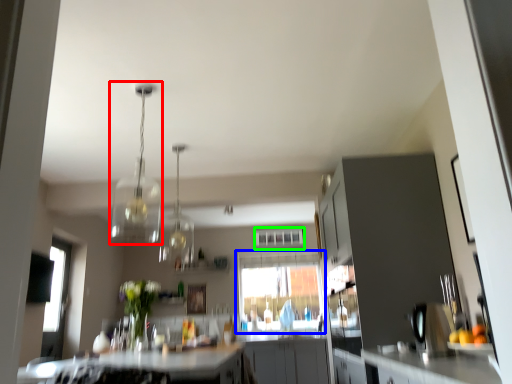
Question: Based on their relative distances, which object is nearer to light fixture (highlighted by a red box)? Choose from window (highlighted by a blue box) and window (highlighted by a green box).

Choices:
 (A) window
 (B) window

Answer: (B)